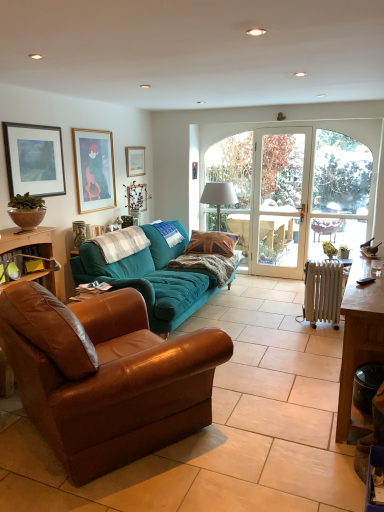
The height and width of the screenshot is (512, 384). What do you see at coordinates (135, 161) in the screenshot?
I see `matte white picture frame at upper center, the third picture frame from the left` at bounding box center [135, 161].

I want to click on matte ceramic vase at upper left, so click(x=79, y=233).

What are the coordinates of `brown wooden table at right` in the screenshot? It's located at (359, 341).

Describe the element at coordinates (34, 159) in the screenshot. The height and width of the screenshot is (512, 384). I see `matte black picture frame at upper left, arranged as the 3th picture frame when viewed from the right` at that location.

How much space does wooden picture frame at upper left, which ranks as the 2th picture frame in front-to-back order, occupy vertically?

34.56 inches.

The width and height of the screenshot is (384, 512). Identify the location of brown leather couch at left, arranged as the 1th studio couch when viewed from the front. (115, 384).

This screenshot has height=512, width=384. What do you see at coordinates (219, 196) in the screenshot? I see `white fabric lampshade at center` at bounding box center [219, 196].

Find the location of a particular element. This screenshot has height=512, width=384. white fabric lampshade at center is located at coordinates (219, 196).

Locate an element on the screen. The height and width of the screenshot is (512, 384). matte white picture frame at upper center, the third picture frame from the left is located at coordinates (135, 161).

From the image's perspective, is matte ceramic vase at upper left below clear glass door at center?

Indeed, from the image's perspective, matte ceramic vase at upper left is shown beneath clear glass door at center.

From a real-world perspective, between matte ceramic vase at upper left and clear glass door at center, who is vertically higher?

clear glass door at center is physically above.

Does matte ceramic vase at upper left have a greater width compared to clear glass door at center?

In fact, matte ceramic vase at upper left might be narrower than clear glass door at center.

In the image, is matte ceramic vase at upper left positioned in front of or behind clear glass door at center?

In the image, matte ceramic vase at upper left appears in front of clear glass door at center.

Image resolution: width=384 pixels, height=512 pixels. I want to click on window screen above the black plastic trash bin at lower right (from a real-world perspective), so click(x=339, y=192).

Looking at this image, could you tell me if black plastic trash bin at lower right is turned towards clear glass door at center?

No, black plastic trash bin at lower right is not facing towards clear glass door at center.

Is black plastic trash bin at lower right situated inside clear glass door at center or outside?

black plastic trash bin at lower right is not inside clear glass door at center, it's outside.

Is black plastic trash bin at lower right at the right side of clear glass door at center?

In fact, black plastic trash bin at lower right is to the left of clear glass door at center.

Is metallic radiator at lower right in front of wooden desk at left?

That is False.

Consider the image. From a real-world perspective, which object rests below the other?

metallic radiator at lower right.

Which object is positioned more to the left, metallic radiator at lower right or wooden desk at left?

wooden desk at left.

What's the angular difference between brown wooden table at right and white fabric lampshade at center's facing directions?

brown wooden table at right and white fabric lampshade at center are facing 88.5 degrees away from each other.

Which is more to the right, brown wooden table at right or white fabric lampshade at center?

brown wooden table at right.

Based on the photo, looking at the image, does brown wooden table at right seem bigger or smaller compared to white fabric lampshade at center?

In the image, brown wooden table at right appears to be larger than white fabric lampshade at center.

From the image's perspective, which one is positioned lower, wooden picture frame at upper left, marked as the second picture frame in a back-to-front arrangement, or matte ceramic vase at upper left?

matte ceramic vase at upper left appears lower in the image.

Is wooden picture frame at upper left, marked as the second picture frame in a back-to-front arrangement, oriented away from matte ceramic vase at upper left?

No, wooden picture frame at upper left, marked as the second picture frame in a back-to-front arrangement,'s orientation is not away from matte ceramic vase at upper left.

Is the depth of wooden picture frame at upper left, which ranks as the 2th picture frame in front-to-back order, less than that of matte ceramic vase at upper left?

No, it is not.

Which of these two, wooden picture frame at upper left, marked as the second picture frame in a back-to-front arrangement, or matte ceramic vase at upper left, is bigger?

wooden picture frame at upper left, marked as the second picture frame in a back-to-front arrangement, is bigger.

What's the angular difference between matte black picture frame at upper left, arranged as the 3th picture frame when viewed from the right, and clear glass door at center's facing directions?

They differ by 90.4 degrees in their facing directions.

In the image, is matte black picture frame at upper left, arranged as the 3th picture frame when viewed from the right, positioned in front of or behind clear glass door at center?

Clearly, matte black picture frame at upper left, arranged as the 3th picture frame when viewed from the right, is in front of clear glass door at center.

Is matte black picture frame at upper left, which is counted as the third picture frame, starting from the back, thinner than clear glass door at center?

No.

From the image's perspective, is matte black picture frame at upper left, arranged as the 3th picture frame when viewed from the right, above clear glass door at center?

Yes, from the image's perspective, matte black picture frame at upper left, arranged as the 3th picture frame when viewed from the right, is on top of clear glass door at center.

From the image's perspective, would you say wooden desk at left is shown under brown leather couch at left, arranged as the 1th studio couch when viewed from the front?

No.

Does point (45, 230) come behind point (78, 484)?

Yes, point (45, 230) is behind point (78, 484).

Considering the sizes of wooden desk at left and brown leather couch at left, arranged as the 1th studio couch when viewed from the front, in the image, is wooden desk at left taller or shorter than brown leather couch at left, arranged as the 1th studio couch when viewed from the front,?

In the image, wooden desk at left appears to be shorter than brown leather couch at left, arranged as the 1th studio couch when viewed from the front.

Consider the image. Based on their sizes in the image, would you say wooden desk at left is bigger or smaller than brown leather couch at left, which appears as the 2th studio couch when viewed from the back?

wooden desk at left is smaller than brown leather couch at left, which appears as the 2th studio couch when viewed from the back.

Where is `vase that is on the left side of clear glass door at center`? vase that is on the left side of clear glass door at center is located at coordinates (79, 233).

What are the coordinates of `window screen on the right of black plastic trash bin at lower right` in the screenshot? It's located at (339, 192).

In the scene shown: From the image, which object appears to be nearer to clear glass door at center, white fabric lampshade at center or metallic radiator at lower right?

metallic radiator at lower right lies closer to clear glass door at center than the other object.

When comparing their distances from clear glass door at center, does clear glass door at center or matte ceramic vase at upper left seem closer?

clear glass door at center.

Estimate the real-world distances between objects in this image. Which object is closer to brown wooden table at right, white fabric lampshade at center or teal fabric couch at center, which is the 2th studio couch in front-to-back order?

Among the two, teal fabric couch at center, which is the 2th studio couch in front-to-back order, is located nearer to brown wooden table at right.

Considering their positions, is wooden desk at left positioned closer to clear glass door at center than brown wooden table at right?

Based on the image, brown wooden table at right appears to be nearer to clear glass door at center.

From the image, which object appears to be farther from teal fabric couch at center, which is the 2th studio couch in front-to-back order, matte white picture frame at upper center, the third picture frame from the left, or clear glass door at center?

Based on the image, clear glass door at center appears to be further to teal fabric couch at center, which is the 2th studio couch in front-to-back order.

Looking at the image, which one is located further to matte black picture frame at upper left, arranged as the 3th picture frame when viewed from the right, black plastic trash bin at lower right or clear glass door at center?

Based on the image, clear glass door at center appears to be further to matte black picture frame at upper left, arranged as the 3th picture frame when viewed from the right.

When comparing their distances from matte ceramic vase at upper left, does brown wooden table at right or brown leather couch at left, arranged as the 1th studio couch when viewed from the front, seem further?

brown wooden table at right is further to matte ceramic vase at upper left.

Estimate the real-world distances between objects in this image. Which object is further from wooden desk at left, matte black picture frame at upper left, arranged as the 3th picture frame when viewed from the right, or teal fabric couch at center, which is the 2th studio couch in front-to-back order?

teal fabric couch at center, which is the 2th studio couch in front-to-back order.

Locate an element on the screen. This screenshot has height=512, width=384. window between matte black picture frame at upper left, which is counted as the third picture frame, starting from the back, and clear glass door at center, in the horizontal direction is located at coordinates (234, 184).

Locate an element on the screen. The height and width of the screenshot is (512, 384). screen door situated between matte white picture frame at upper center, which is counted as the 1th picture frame, starting from the right, and metallic radiator at lower right from left to right is located at coordinates (279, 202).

Find the location of `trash bin/can situated between matte black picture frame at upper left, arranged as the 1th picture frame when viewed from the left, and clear glass door at center from left to right`. trash bin/can situated between matte black picture frame at upper left, arranged as the 1th picture frame when viewed from the left, and clear glass door at center from left to right is located at coordinates click(x=367, y=385).

Locate an element on the screen. lamp between teal fabric couch at center, the first studio couch positioned from the back, and matte white picture frame at upper center, which is counted as the 1th picture frame, starting from the right, along the z-axis is located at coordinates point(219,196).